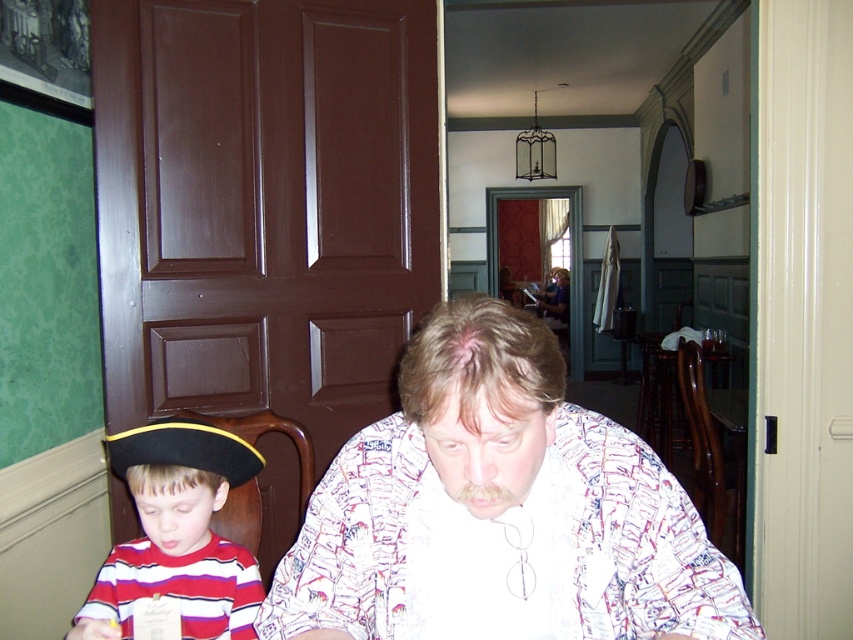
You are a tailor measuring shirts for a customer. You have two shirts in front of you, the white printed shirt at center and the striped cotton shirt at lower left. Which shirt has a larger width?

The white printed shirt at center has a larger width than the striped cotton shirt at lower left according to the description.

What is the exact location of the white printed shirt at center in the image?

The white printed shirt at center is located at point (502,497).

You are a tailor who needs to determine the correct placement of two shirts on a rack. The white printed shirt at center and the striped cotton shirt at lower left are both on the rack. Based on their sizes, which shirt should be placed higher on the rack?

The white printed shirt at center should be placed higher on the rack because it is much taller than the striped cotton shirt at lower left.